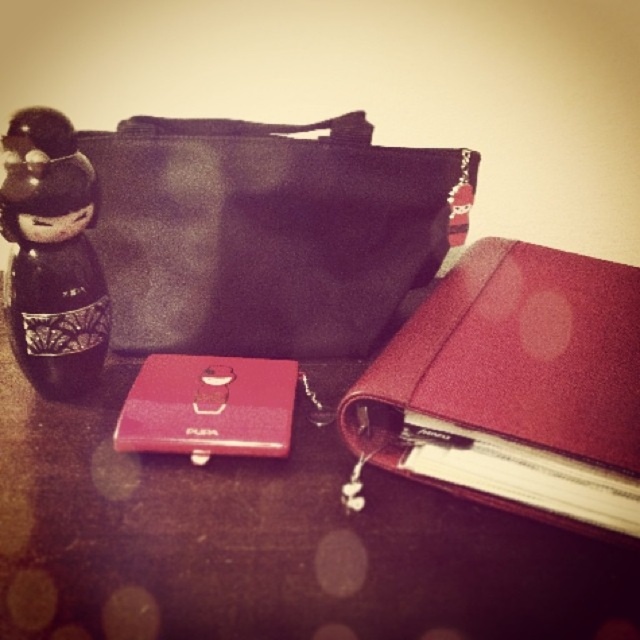
Question: Which point appears closest to the camera in this image?

Choices:
 (A) (376, 272)
 (B) (35, 218)

Answer: (B)

Question: Is satin burgundy binder at center positioned in front of black glossy figurine at left?

Choices:
 (A) yes
 (B) no

Answer: (A)

Question: Considering the relative positions of black fabric bag at upper left and satin burgundy binder at center in the image provided, where is black fabric bag at upper left located with respect to satin burgundy binder at center?

Choices:
 (A) above
 (B) below

Answer: (A)

Question: Does black fabric bag at upper left have a smaller size compared to black glossy figurine at left?

Choices:
 (A) no
 (B) yes

Answer: (A)

Question: Which point is farther from the camera taking this photo?

Choices:
 (A) (579, 490)
 (B) (112, 193)

Answer: (B)

Question: Among these objects, which one is farthest from the camera?

Choices:
 (A) black glossy figurine at left
 (B) black fabric bag at upper left

Answer: (B)